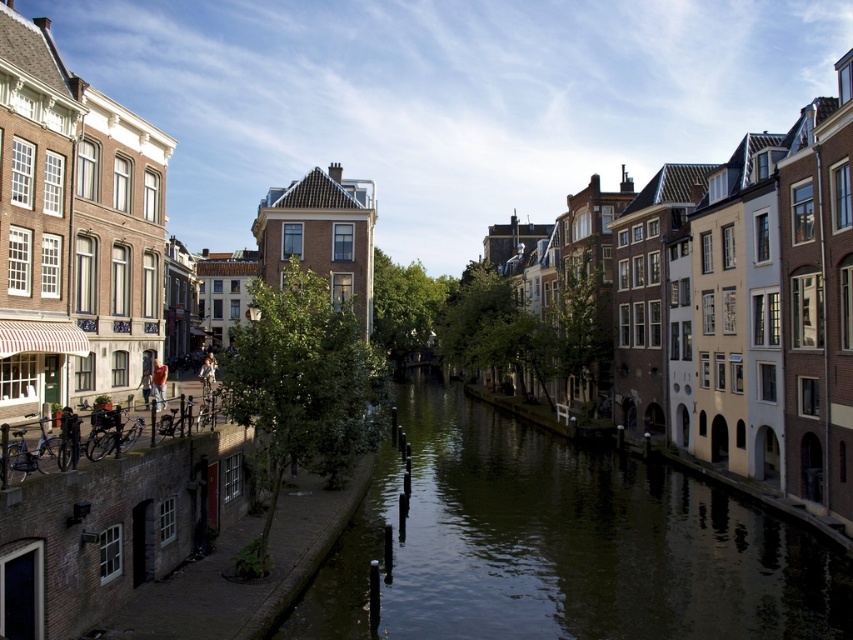
You are standing on a bridge overlooking the canal and see the greenish water at center and the light brown leather jacket at left. Which object is positioned higher from the ground?

The light brown leather jacket at left is positioned higher from the ground than the greenish water at center because the greenish water at center is below the light brown leather jacket at left.

You are standing on the bridge overlooking the greenish water at center and the light brown leather jacket at left. If you want to throw a small stone into the water, which area would you aim for to ensure it lands in the wider space?

You should aim for the greenish water at center because its width surpasses that of the light brown leather jacket at left, providing a wider area for the stone to land.